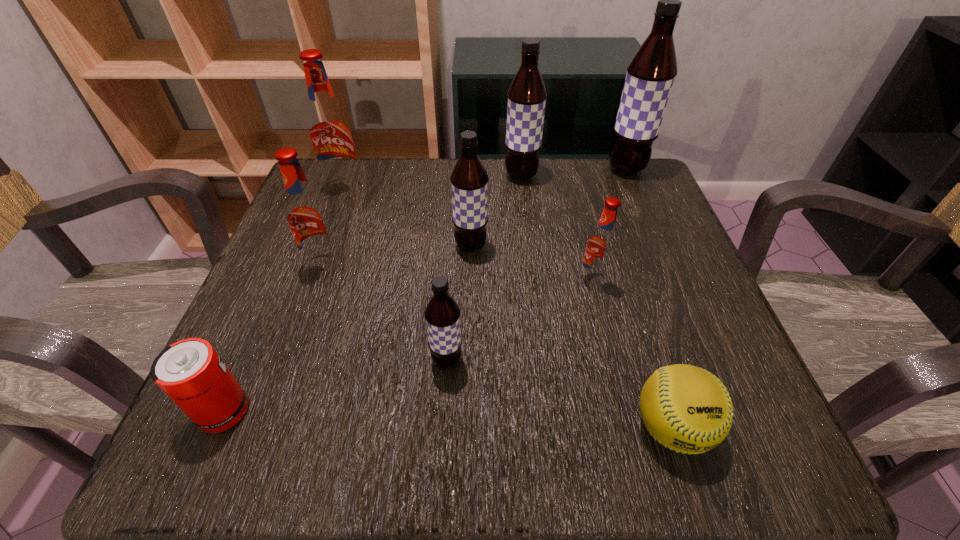
Identify which brown root beer is the second closest to the third farthest brown root beer. Please provide its 2D coordinates. Your answer should be formatted as a tuple, i.e. [(x, y)], where the tuple contains the x and y coordinates of a point satisfying the conditions above.

[(442, 313)]

Select which red root beer appears as the third closest to the biggest brown root beer. Please provide its 2D coordinates. Your answer should be formatted as a tuple, i.e. [(x, y)], where the tuple contains the x and y coordinates of a point satisfying the conditions above.

[(307, 217)]

The width and height of the screenshot is (960, 540). What are the coordinates of `red root beer that is the closest to the sixth root beer from left to right` in the screenshot? It's located at (307, 217).

Locate an element on the screen. The image size is (960, 540). vacant point that satisfies the following two spatial constraints: 1. on the back side of the nearest root beer; 2. on the right side of the rightmost brown root beer is located at coordinates (459, 170).

Where is `free region that satisfies the following two spatial constraints: 1. on the front side of the third nearest object; 2. on the right side of the biggest red root beer`? The image size is (960, 540). free region that satisfies the following two spatial constraints: 1. on the front side of the third nearest object; 2. on the right side of the biggest red root beer is located at coordinates [x=282, y=361].

At what (x,y) coordinates should I click in order to perform the action: click on blank area in the image that satisfies the following two spatial constraints: 1. on the back side of the smallest red root beer; 2. on the right side of the nearest brown root beer. Please return your answer as a coordinate pair (x, y). This screenshot has height=540, width=960. Looking at the image, I should click on (452, 280).

Where is `free location that satisfies the following two spatial constraints: 1. on the front side of the biggest red root beer; 2. on the right side of the rightmost red root beer`? The image size is (960, 540). free location that satisfies the following two spatial constraints: 1. on the front side of the biggest red root beer; 2. on the right side of the rightmost red root beer is located at coordinates (312, 280).